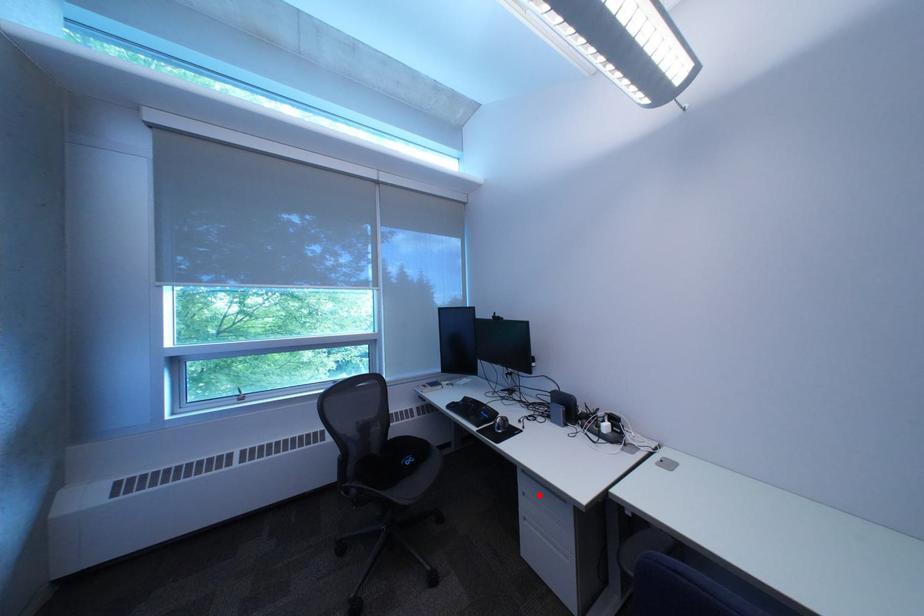
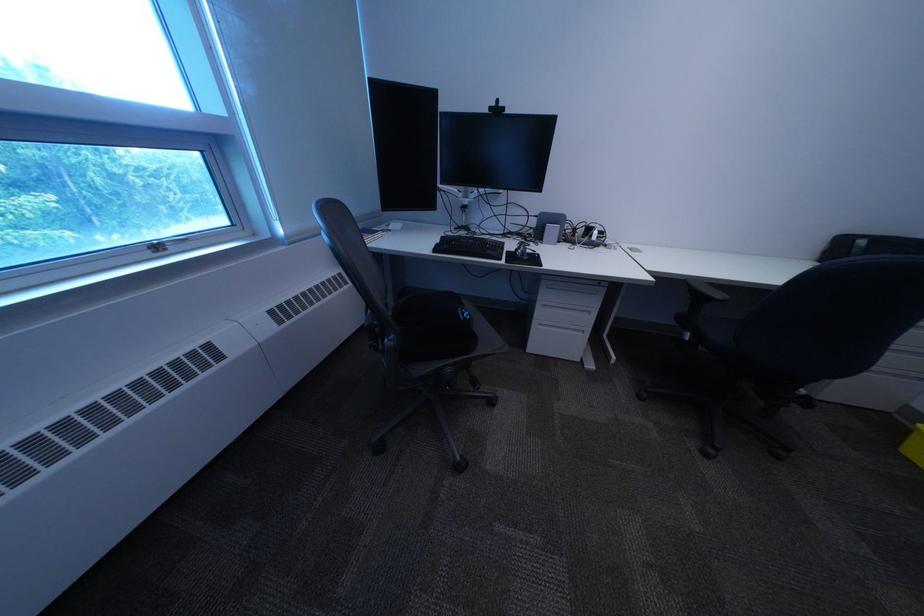
In the second image, find the point that corresponds to the highlighted location in the first image.

(558, 307)